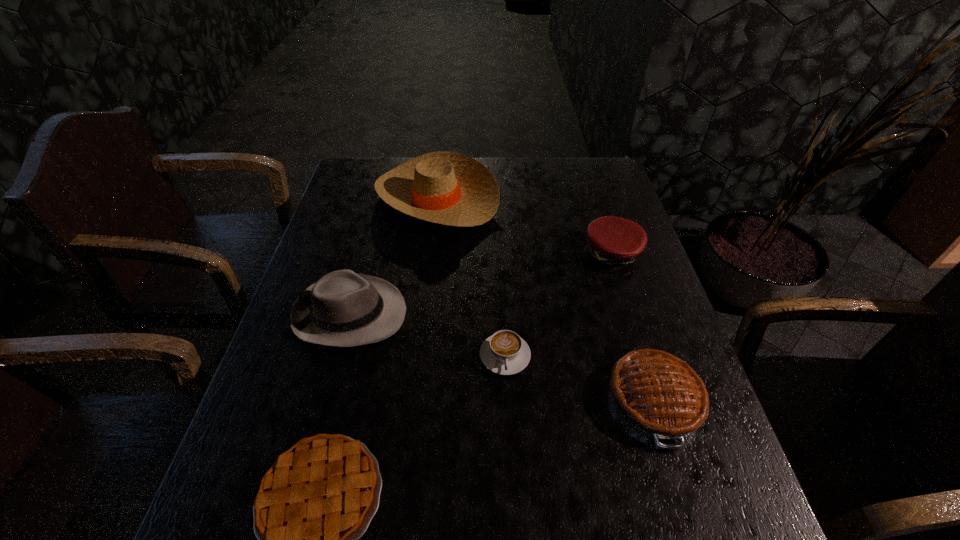
What are the coordinates of `object at the far edge` in the screenshot? It's located at (443, 187).

You are a GUI agent. You are given a task and a screenshot of the screen. Output one action in this format:
    pyautogui.click(x=<x>, y=<y>)
    Task: Click on the sunhat that is at the left edge
    Image resolution: width=960 pixels, height=540 pixels.
    Given the screenshot: What is the action you would take?
    pyautogui.click(x=443, y=187)

This screenshot has height=540, width=960. Identify the location of fedora that is at the left edge. (342, 309).

Locate an element on the screen. cap positioned at the right edge is located at coordinates pyautogui.click(x=614, y=242).

This screenshot has width=960, height=540. Find the location of `pie located at the right edge`. pie located at the right edge is located at coordinates (656, 393).

The width and height of the screenshot is (960, 540). I want to click on object that is at the far left corner, so click(x=443, y=187).

In the image, there is a desktop. At what (x,y) coordinates should I click in order to perform the action: click on vacant space at the far edge. Please return your answer as a coordinate pair (x, y). Looking at the image, I should click on (523, 170).

The width and height of the screenshot is (960, 540). Identify the location of free region at the left edge. (341, 202).

This screenshot has height=540, width=960. In the image, there is a desktop. In order to click on free space at the right edge in this screenshot , I will do `click(601, 217)`.

Find the location of `free point between the cappuccino and the sunhat`. free point between the cappuccino and the sunhat is located at coordinates (471, 276).